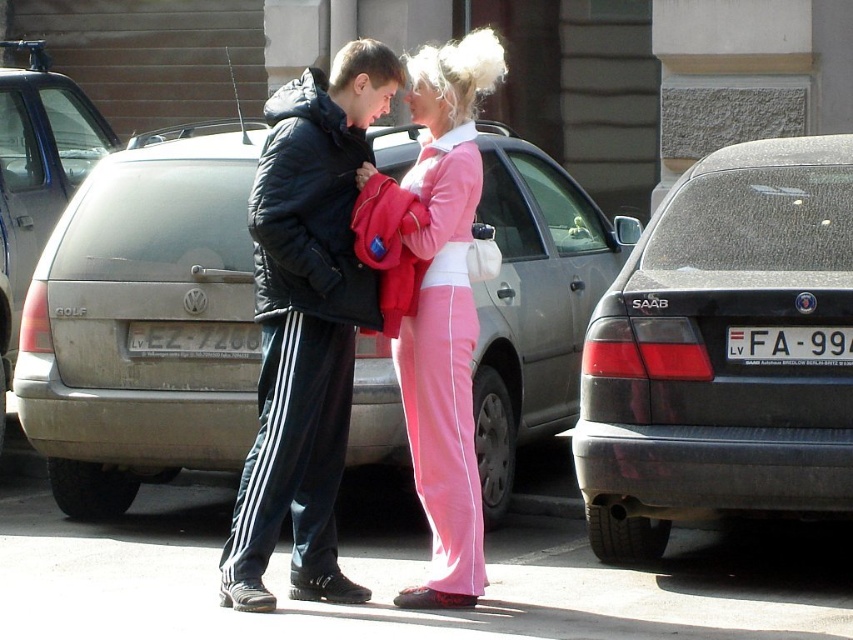
You are standing at the point marked as point (306, 324) in the image. What is the nearest object to you?

The nearest object to you at point (306, 324) is the black puffy jacket at center.

You are a delivery driver who needs to park your car between the silver metallic hatchback at center and the white plastic license plate at center. Is there enough space for your car, which is 4.5 meters long?

The silver metallic hatchback at center is positioned on the left side of white plastic license plate at center. Since the distance between them isn not specified, it is impossible to determine if there is enough space for a 4.5 meter long car. Please check the actual distance before attempting to park.